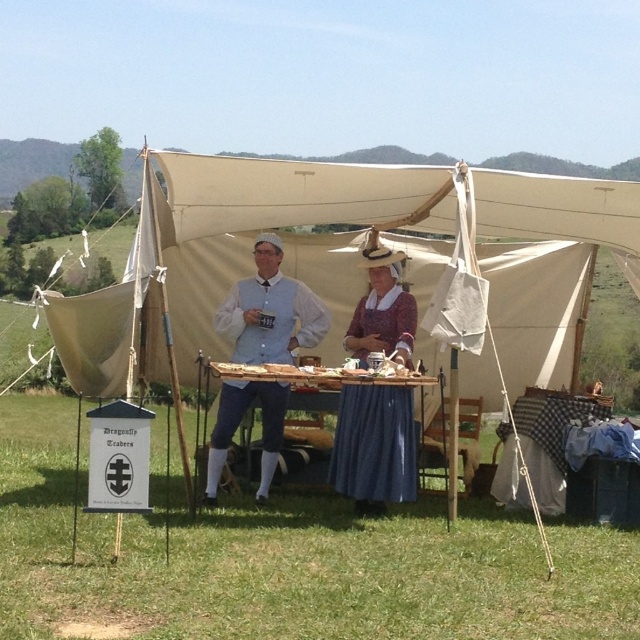
Is rustic wooden table at center closer to the viewer compared to blue fabric table at center?

No, it is not.

Who is positioned more to the left, rustic wooden table at center or blue fabric table at center?

blue fabric table at center is more to the left.

The image size is (640, 640). What do you see at coordinates (374, 445) in the screenshot? I see `rustic wooden table at center` at bounding box center [374, 445].

At what (x,y) coordinates should I click in order to perform the action: click on rustic wooden table at center. Please return your answer as a coordinate pair (x, y). This screenshot has width=640, height=640. Looking at the image, I should click on (374, 445).

Which is behind, point (400, 497) or point (291, 362)?

The point (291, 362) is more distant.

Is rustic wooden table at center above white cotton shirt at center?

Yes.

Where is `rustic wooden table at center`? This screenshot has width=640, height=640. rustic wooden table at center is located at coordinates (374, 445).

Which is above, beige canvas tent at center or blue fabric table at center?

beige canvas tent at center

Between beige canvas tent at center and blue fabric table at center, which one has more height?

With more height is beige canvas tent at center.

Find the location of a particular element. beige canvas tent at center is located at coordinates (326, 221).